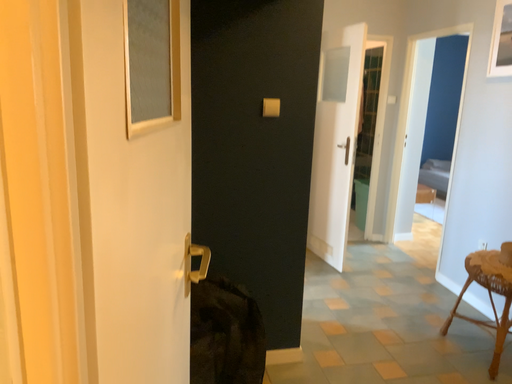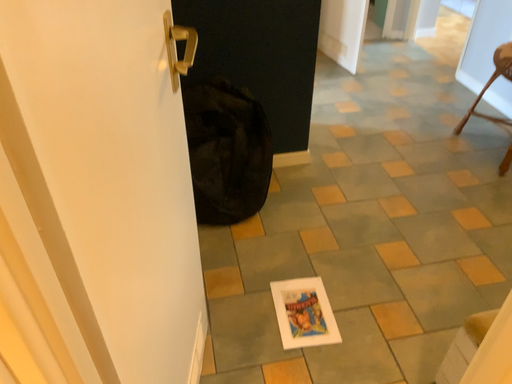
Question: How did the camera likely rotate when shooting the video?

Choices:
 (A) rotated upward
 (B) rotated downward

Answer: (B)